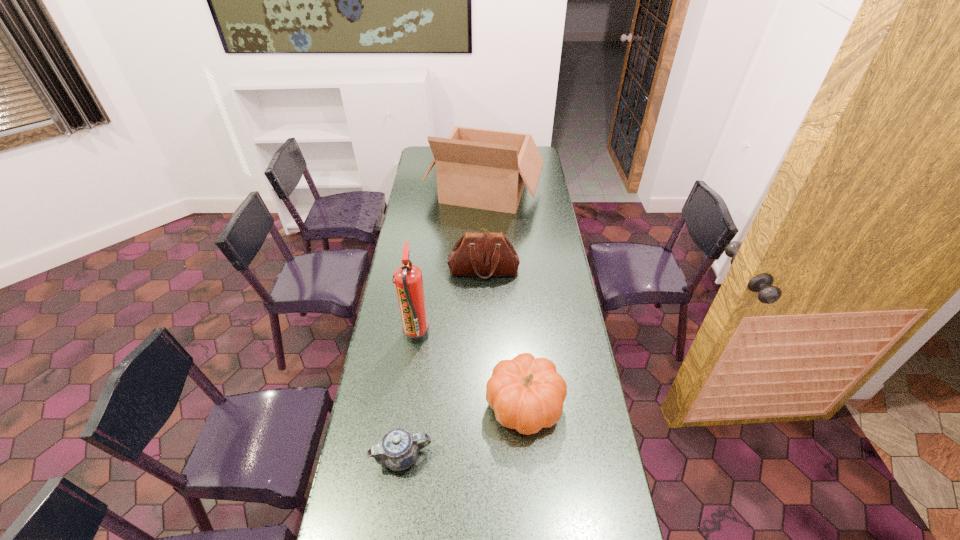
You are a GUI agent. You are given a task and a screenshot of the screen. Output one action in this format:
    pyautogui.click(x=<x>, y=<y>)
    Task: Click on the vacant space at the far left corner of the desktop
    The width and height of the screenshot is (960, 540).
    Given the screenshot: What is the action you would take?
    pyautogui.click(x=428, y=159)

In order to click on free space between the shortest object and the fire extinguisher in this screenshot , I will do `click(409, 396)`.

I want to click on free spot between the second shortest object and the shortest object, so click(x=464, y=430).

Where is `free spot between the shoulder bag and the third farthest object`? free spot between the shoulder bag and the third farthest object is located at coordinates (450, 302).

The width and height of the screenshot is (960, 540). I want to click on vacant space that is in between the chinaware and the box, so click(444, 323).

Select which object appears as the closest to the pumpkin. Please provide its 2D coordinates. Your answer should be formatted as a tuple, i.e. [(x, y)], where the tuple contains the x and y coordinates of a point satisfying the conditions above.

[(398, 449)]

Locate an element on the screen. object that is the second nearest to the fire extinguisher is located at coordinates (527, 394).

In order to click on vacant space that satisfies the following two spatial constraints: 1. on the front side of the fourth tallest object; 2. from the spout of the chinaware in this screenshot , I will do `click(529, 456)`.

Locate an element on the screen. vacant space that satisfies the following two spatial constraints: 1. with the nozzle pointing from the back of the fire extinguisher; 2. on the left side of the second shortest object is located at coordinates (406, 405).

At what (x,y) coordinates should I click in order to perform the action: click on vacant space that satisfies the following two spatial constraints: 1. on the front side of the box; 2. with the nozzle pointing from the back of the third farthest object. Please return your answer as a coordinate pair (x, y). The image size is (960, 540). Looking at the image, I should click on (487, 335).